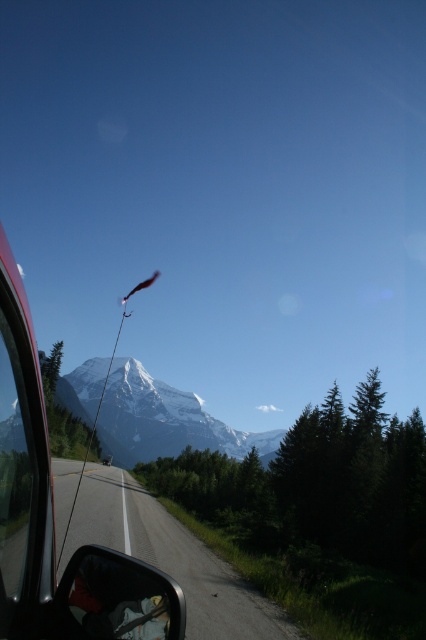
Which is in front, point (2, 246) or point (178, 612)?

Point (2, 246) is in front.

Looking at this image, who is positioned more to the right, metallic red car at left or matte black side mirror at lower left?

matte black side mirror at lower left

Does point (49, 538) lie behind point (88, 550)?

Yes.

Locate an element on the screen. This screenshot has height=640, width=426. metallic red car at left is located at coordinates (54, 516).

Can you confirm if asphalt road at center is positioned to the left of matte black side mirror at lower left?

Yes, asphalt road at center is to the left of matte black side mirror at lower left.

Is point (186, 637) more distant than point (158, 618)?

Yes, it is.

Which is in front, point (288, 637) or point (147, 634)?

Point (147, 634) is in front.

Find the location of a particular element. The image size is (426, 640). asphalt road at center is located at coordinates (170, 557).

Is asphalt road at center shorter than white snow-covered mountain at center?

Correct, asphalt road at center is not as tall as white snow-covered mountain at center.

Between point (227, 570) and point (85, 419), which one is positioned behind?

Positioned behind is point (85, 419).

Locate an element on the screen. asphalt road at center is located at coordinates (170, 557).

Where is `asphalt road at center`? asphalt road at center is located at coordinates (170, 557).